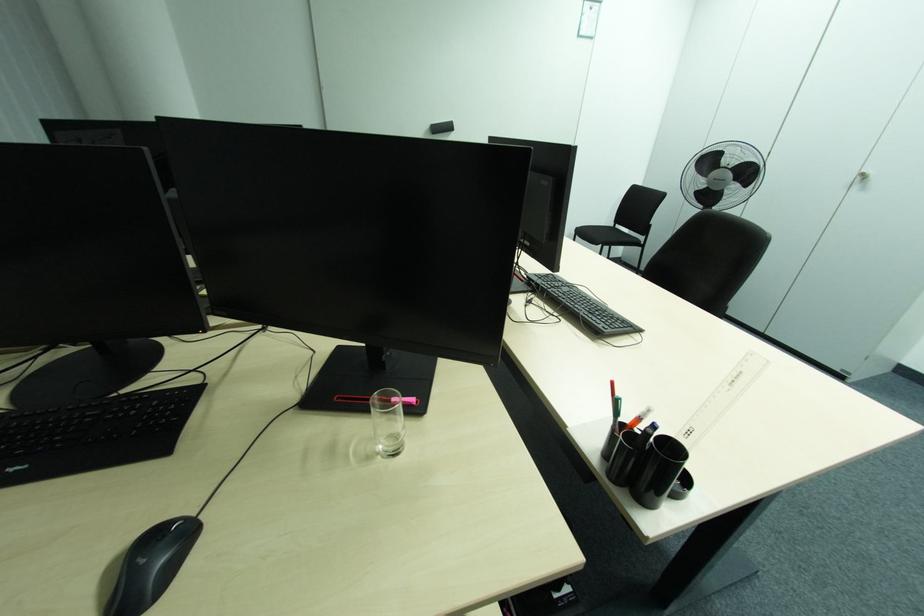
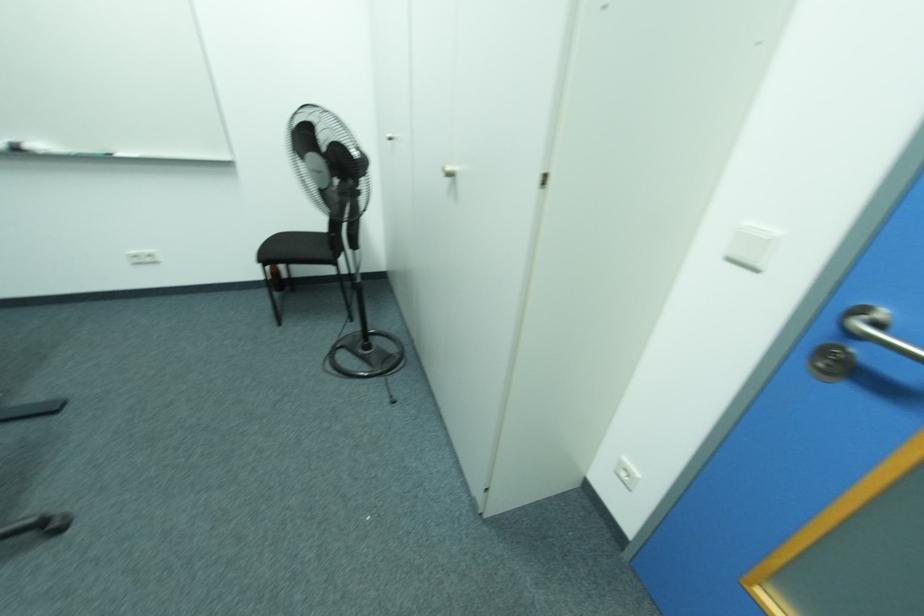
What movement of the cameraman would produce the second image?

The cameraman walked toward right, forward.